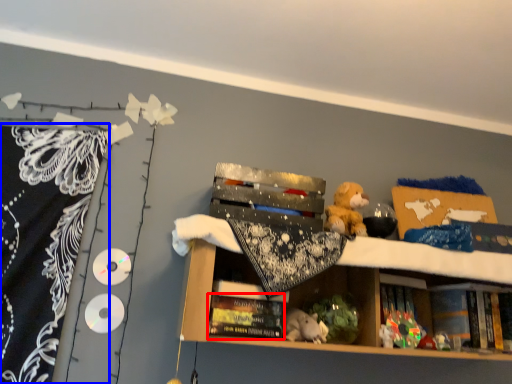
Question: Which object is closer to the camera taking this photo, book (highlighted by a red box) or blanket (highlighted by a blue box)?

Choices:
 (A) book
 (B) blanket

Answer: (A)